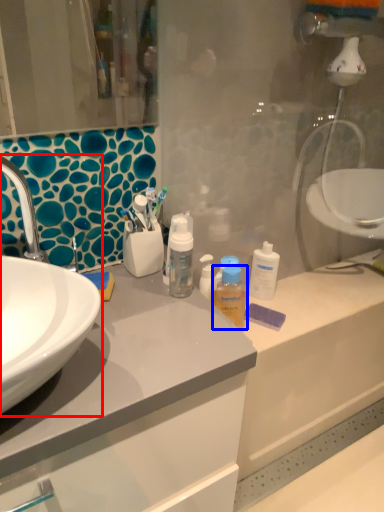
Question: Among these objects, which one is nearest to the camera, sink (highlighted by a red box) or mouthwash (highlighted by a blue box)?

Choices:
 (A) sink
 (B) mouthwash

Answer: (A)